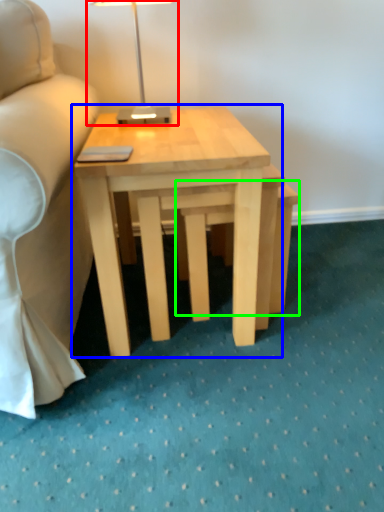
Question: Estimate the real-world distances between objects in this image. Which object is closer to table lamp (highlighted by a red box), coffee table (highlighted by a blue box) or step stool (highlighted by a green box)?

Choices:
 (A) coffee table
 (B) step stool

Answer: (A)